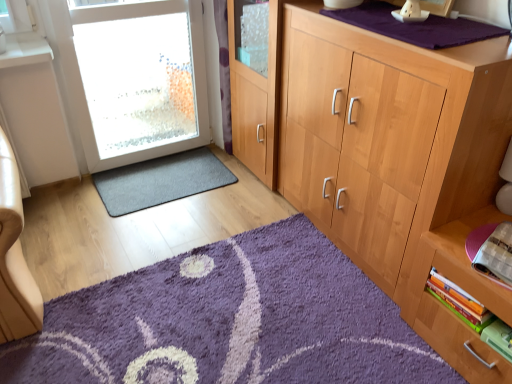
Question: From the image's perspective, would you say white frosted glass door at left is positioned over hardcover book at lower right, which appears as the 3th book when ordered from the bottom?

Choices:
 (A) yes
 (B) no

Answer: (A)

Question: Is white frosted glass door at left not within hardcover book at lower right, which appears as the 3th book when ordered from the bottom?

Choices:
 (A) no
 (B) yes

Answer: (B)

Question: Is hardcover book at lower right, which appears as the 3th book when ordered from the bottom, at the back of white frosted glass door at left?

Choices:
 (A) yes
 (B) no

Answer: (B)

Question: Does white frosted glass door at left lie behind hardcover book at lower right, placed as the first book when sorted from top to bottom?

Choices:
 (A) no
 (B) yes

Answer: (B)

Question: Can you confirm if white frosted glass door at left is positioned to the right of hardcover book at lower right, placed as the first book when sorted from top to bottom?

Choices:
 (A) no
 (B) yes

Answer: (A)

Question: From a real-world perspective, is hardcover book at lower right, acting as the second book starting from the bottom, physically located above or below hardcover book at lower right, which appears as the 3th book when ordered from the bottom?

Choices:
 (A) below
 (B) above

Answer: (A)

Question: Is hardcover book at lower right, which is the 2th book from top to bottom, situated inside hardcover book at lower right, placed as the first book when sorted from top to bottom, or outside?

Choices:
 (A) inside
 (B) outside

Answer: (B)

Question: Relative to hardcover book at lower right, which appears as the 3th book when ordered from the bottom, is hardcover book at lower right, acting as the second book starting from the bottom, in front or behind?

Choices:
 (A) front
 (B) behind

Answer: (B)

Question: Considering the positions of hardcover book at lower right, which is the 2th book from top to bottom, and hardcover book at lower right, placed as the first book when sorted from top to bottom, in the image, is hardcover book at lower right, which is the 2th book from top to bottom, taller or shorter than hardcover book at lower right, placed as the first book when sorted from top to bottom,?

Choices:
 (A) tall
 (B) short

Answer: (A)

Question: Is point (183, 1) closer or farther from the camera than point (1, 347)?

Choices:
 (A) closer
 (B) farther

Answer: (B)

Question: Is white frosted glass door at left situated inside purple shaggy rug at lower center, the 1th doormat viewed from the front, or outside?

Choices:
 (A) outside
 (B) inside

Answer: (A)

Question: From a real-world perspective, is white frosted glass door at left above or below purple shaggy rug at lower center, the 2th doormat from the top?

Choices:
 (A) above
 (B) below

Answer: (A)

Question: Is white frosted glass door at left in front of or behind purple shaggy rug at lower center, the 2th doormat from the top, in the image?

Choices:
 (A) behind
 (B) front

Answer: (A)

Question: Is point (327, 327) closer or farther from the camera than point (509, 243)?

Choices:
 (A) farther
 (B) closer

Answer: (A)

Question: Considering their positions, is purple shaggy rug at lower center, the 2th doormat from the top, located in front of or behind hardcover book at lower right, placed as the first book when sorted from top to bottom?

Choices:
 (A) front
 (B) behind

Answer: (A)